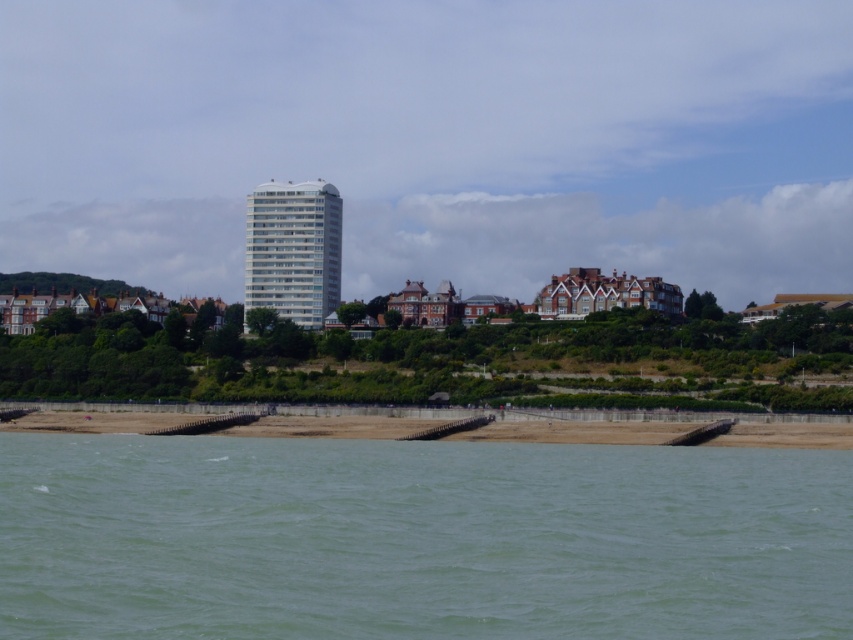
Which is above, green water at lower center or brown sand at lower center?

Positioned higher is brown sand at lower center.

Looking at this image, is green water at lower center to the right of brown sand at lower center from the viewer's perspective?

Indeed, green water at lower center is positioned on the right side of brown sand at lower center.

Is point (122, 556) positioned after point (480, 432)?

No, it is in front of (480, 432).

Where is `green water at lower center`? Image resolution: width=853 pixels, height=640 pixels. green water at lower center is located at coordinates (419, 538).